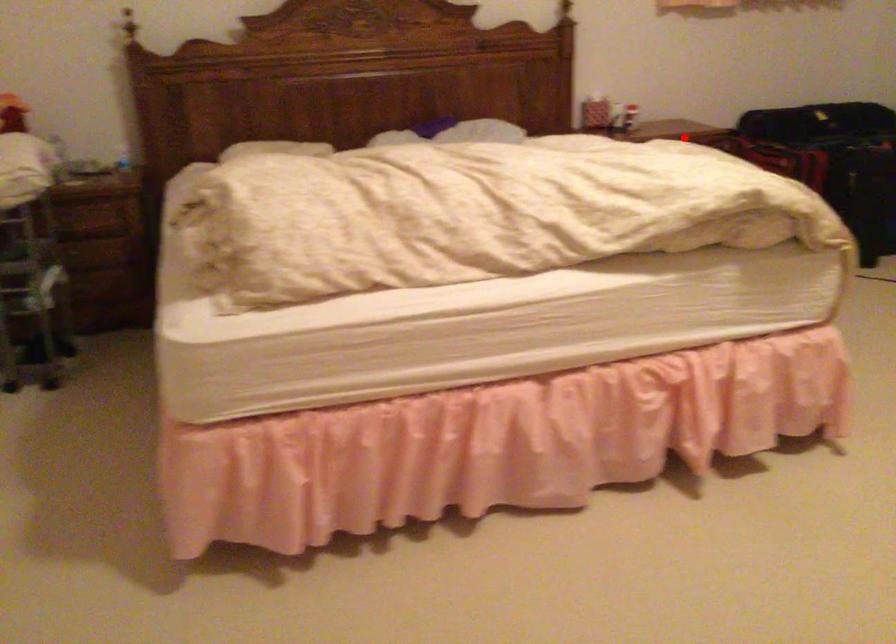
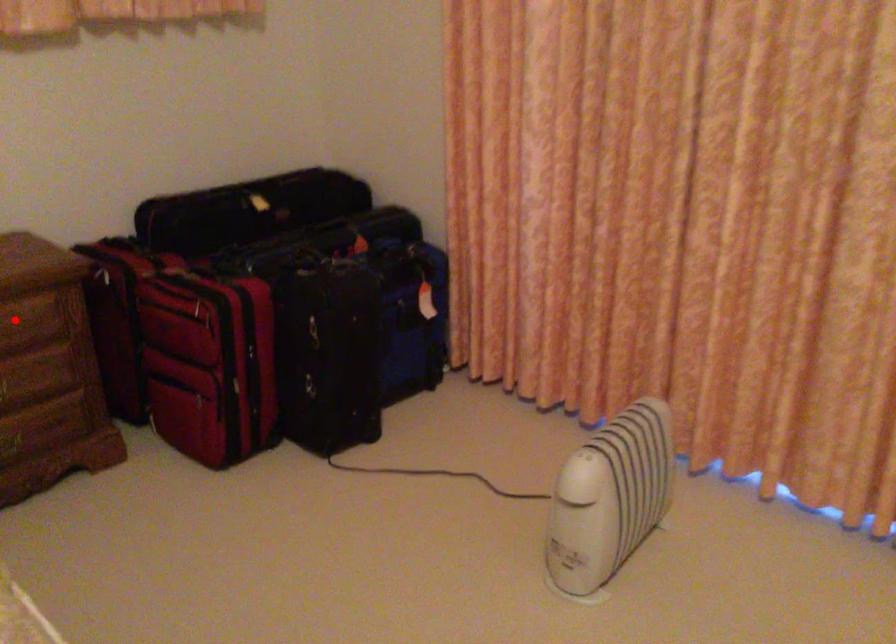
I am providing you with two images of the same scene from different viewpoints. A red point is marked on the first image and another point is marked on the second image. Is the red point in image1 aligned with the point shown in image2?

Yes